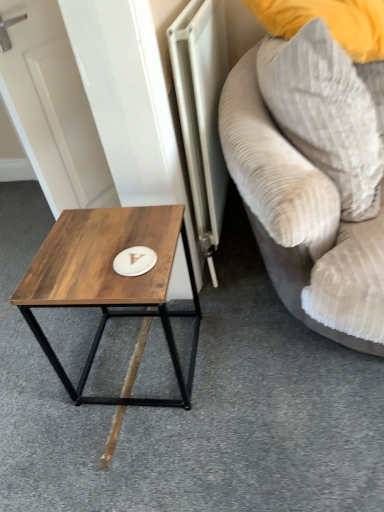
Question: From the image's perspective, is wooden table at left located above velvet beige couch at right?

Choices:
 (A) no
 (B) yes

Answer: (A)

Question: Does wooden table at left have a lesser height compared to velvet beige couch at right?

Choices:
 (A) yes
 (B) no

Answer: (A)

Question: Could you tell me if wooden table at left is facing velvet beige couch at right?

Choices:
 (A) no
 (B) yes

Answer: (A)

Question: Does wooden table at left have a greater width compared to velvet beige couch at right?

Choices:
 (A) no
 (B) yes

Answer: (A)

Question: Does wooden table at left appear on the right side of velvet beige couch at right?

Choices:
 (A) yes
 (B) no

Answer: (B)

Question: Looking at the image, does gray corduroy pillow at upper right seem bigger or smaller compared to metallic silver radiator at center?

Choices:
 (A) small
 (B) big

Answer: (B)

Question: Is gray corduroy pillow at upper right inside or outside of metallic silver radiator at center?

Choices:
 (A) outside
 (B) inside

Answer: (A)

Question: Considering their positions, is gray corduroy pillow at upper right located in front of or behind metallic silver radiator at center?

Choices:
 (A) behind
 (B) front

Answer: (B)

Question: In the image, is gray corduroy pillow at upper right on the left side or the right side of metallic silver radiator at center?

Choices:
 (A) left
 (B) right

Answer: (B)

Question: Based on their positions, is metallic silver radiator at center located to the left or right of wooden table at left?

Choices:
 (A) right
 (B) left

Answer: (A)

Question: Looking at the image, does metallic silver radiator at center seem bigger or smaller compared to wooden table at left?

Choices:
 (A) small
 (B) big

Answer: (B)

Question: Does point (216, 18) appear closer or farther from the camera than point (34, 264)?

Choices:
 (A) farther
 (B) closer

Answer: (A)

Question: Is metallic silver radiator at center in front of or behind wooden table at left in the image?

Choices:
 (A) front
 (B) behind

Answer: (B)

Question: Is point (109, 259) closer or farther from the camera than point (369, 199)?

Choices:
 (A) farther
 (B) closer

Answer: (B)

Question: Is wooden table at left to the left or to the right of gray corduroy pillow at upper right in the image?

Choices:
 (A) left
 (B) right

Answer: (A)